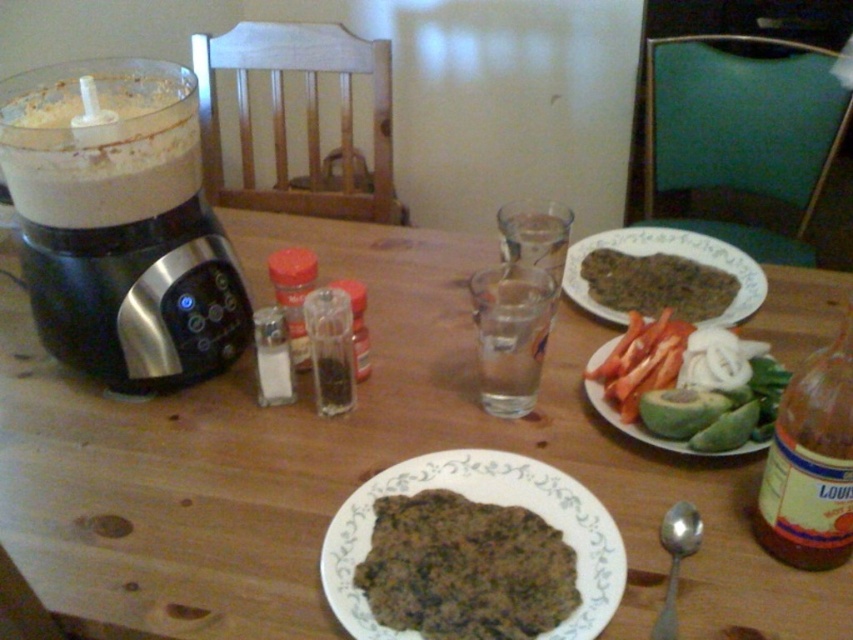
Question: Which of the following is the closest to the observer?

Choices:
 (A) red glass spice at center
 (B) brown matte flatbread at upper right
 (C) clear glass water at center

Answer: (C)

Question: Which point appears closest to the camera in this image?

Choices:
 (A) (543, 588)
 (B) (608, 259)
 (C) (640, 397)

Answer: (A)

Question: Is brown glass bottle at right behind brown matte flatbread at upper right?

Choices:
 (A) yes
 (B) no

Answer: (B)

Question: Can you confirm if brown glass bottle at right is smaller than red glass spice at center?

Choices:
 (A) no
 (B) yes

Answer: (A)

Question: Does green matte avocado at right have a lesser width compared to red glass spice at center?

Choices:
 (A) no
 (B) yes

Answer: (A)

Question: Estimate the real-world distances between objects in this image. Which object is farther from the clear glass water at center?

Choices:
 (A) wooden table at center
 (B) satin silver spoon at lower right
 (C) red glass spice at center

Answer: (A)